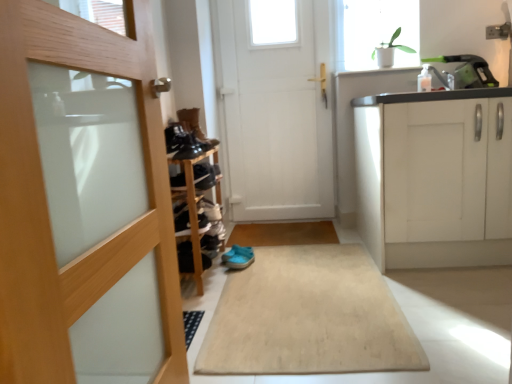
Question: From the image's perspective, is white matte door at center, which is counted as the 1th door, starting from the right, located beneath shiny black shoe at center, marked as the third shoe in a top-to-bottom arrangement?

Choices:
 (A) no
 (B) yes

Answer: (A)

Question: Could you tell me if white matte door at center, the 1th door viewed from the back, is turned towards shiny black shoe at center, the 3th shoe when ordered from bottom to top?

Choices:
 (A) yes
 (B) no

Answer: (A)

Question: Considering the relative positions of white matte door at center, the 1th door viewed from the back, and shiny black shoe at center, the 3th shoe when ordered from bottom to top, in the image provided, is white matte door at center, the 1th door viewed from the back, to the left of shiny black shoe at center, the 3th shoe when ordered from bottom to top, from the viewer's perspective?

Choices:
 (A) no
 (B) yes

Answer: (A)

Question: Is the depth of white matte door at center, the 1th door viewed from the back, less than that of shiny black shoe at center, marked as the third shoe in a top-to-bottom arrangement?

Choices:
 (A) yes
 (B) no

Answer: (B)

Question: From the image's perspective, is white matte door at center, acting as the 2th door starting from the front, on shiny black shoe at center, which appears as the second shoe when viewed from the back?

Choices:
 (A) yes
 (B) no

Answer: (A)

Question: Is white matte door at center, the 1th door viewed from the back, looking in the opposite direction of shiny black shoe at center, which appears as the second shoe when viewed from the back?

Choices:
 (A) no
 (B) yes

Answer: (A)

Question: From the image's perspective, is shiny black shoe at center, which is the fourth shoe from front to back, beneath white glossy sink at upper right?

Choices:
 (A) yes
 (B) no

Answer: (A)

Question: Is shiny black shoe at center, the 3th shoe when ordered from bottom to top, further to the viewer compared to white glossy sink at upper right?

Choices:
 (A) no
 (B) yes

Answer: (A)

Question: From the image's perspective, does shiny black shoe at center, which is the fourth shoe from front to back, appear higher than white glossy sink at upper right?

Choices:
 (A) no
 (B) yes

Answer: (A)

Question: Is shiny black shoe at center, which is the fourth shoe from front to back, at the left side of white glossy sink at upper right?

Choices:
 (A) yes
 (B) no

Answer: (A)

Question: Is shiny black shoe at center, the 3th shoe when ordered from bottom to top, positioned with its back to white glossy sink at upper right?

Choices:
 (A) no
 (B) yes

Answer: (A)

Question: Is shiny black shoe at center, the 3th shoe when ordered from bottom to top, thinner than white glossy sink at upper right?

Choices:
 (A) yes
 (B) no

Answer: (B)

Question: Is shiny black shoes at center, the 2th shoe in the top-to-bottom sequence, facing towards shiny black shoe at center, which appears as the second shoe when viewed from the back?

Choices:
 (A) no
 (B) yes

Answer: (A)